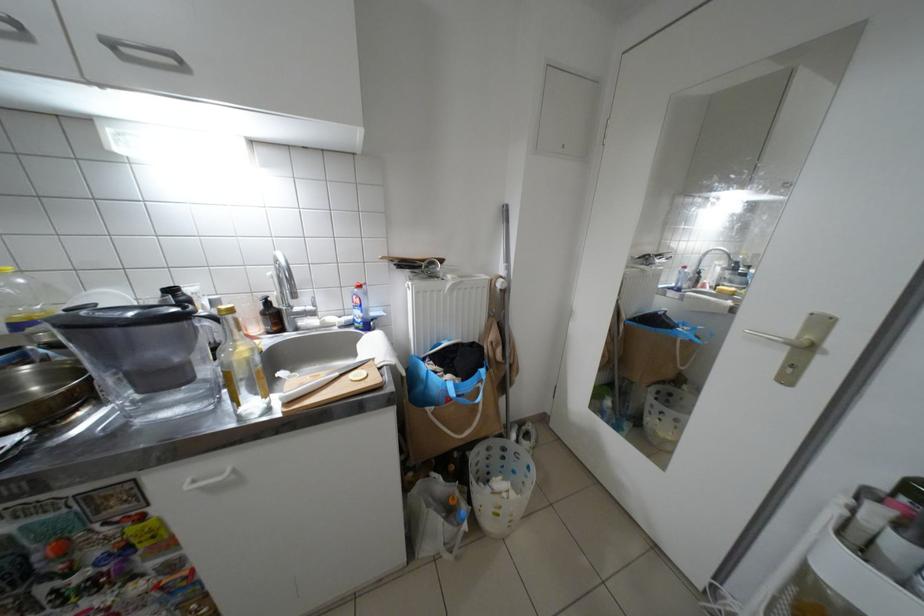
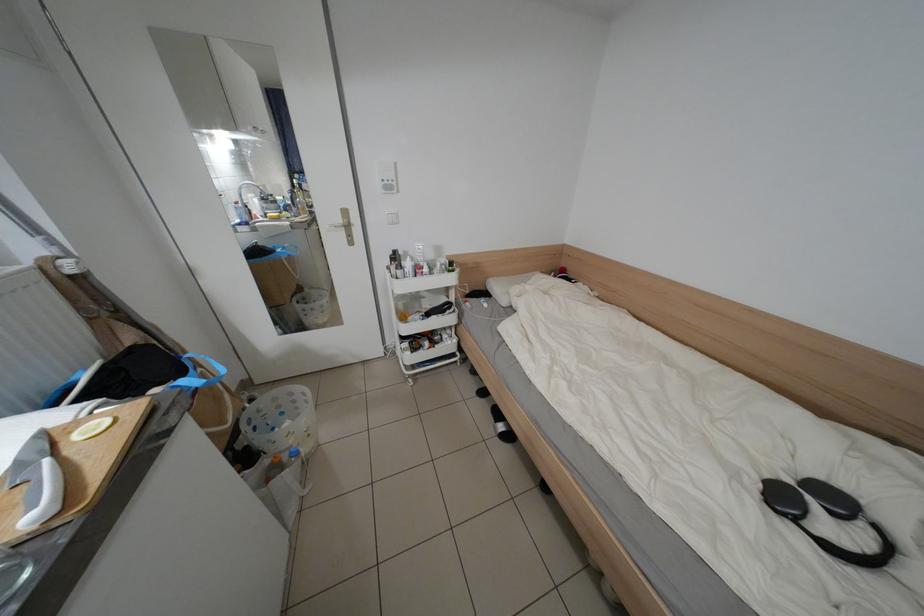
The first image is from the beginning of the video and the second image is from the end. How did the camera likely rotate when shooting the video?

The camera's rotation is toward right-down.